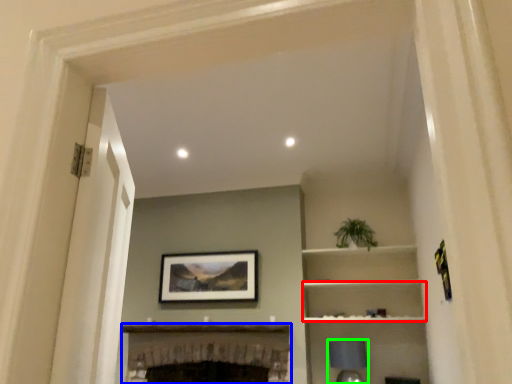
Question: Based on their relative distances, which object is farther from cabinet (highlighted by a red box)? Choose from fireplace (highlighted by a blue box) and lamp (highlighted by a green box).

Choices:
 (A) fireplace
 (B) lamp

Answer: (A)